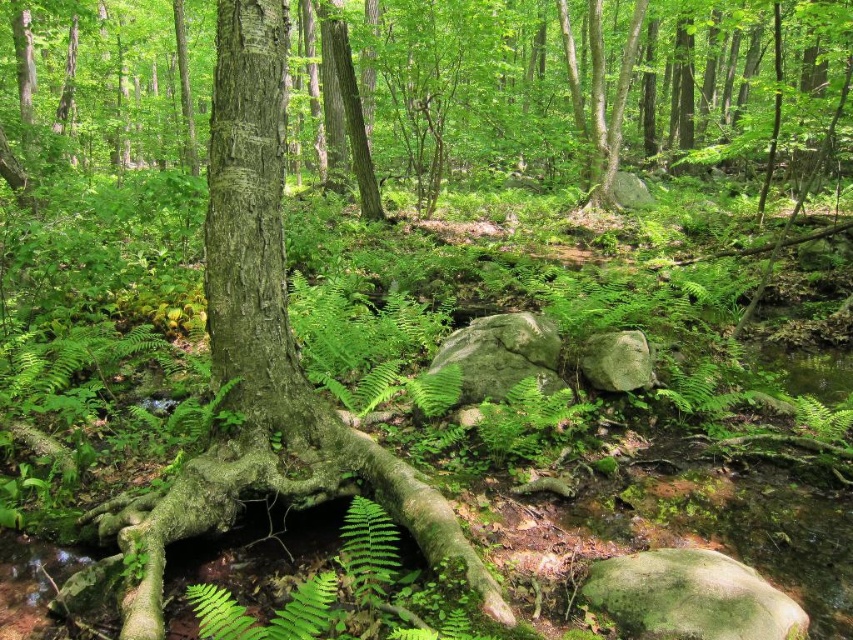
From the picture: Which is above, green mossy rock at center or gray rough rock at center?

green mossy rock at center is higher up.

Is point (479, 353) positioned behind point (630, 356)?

Yes, point (479, 353) is behind point (630, 356).

Is point (554, 356) positioned in front of point (618, 376)?

No, (554, 356) is further to viewer.

Where is `green mossy rock at center`? Image resolution: width=853 pixels, height=640 pixels. green mossy rock at center is located at coordinates (502, 355).